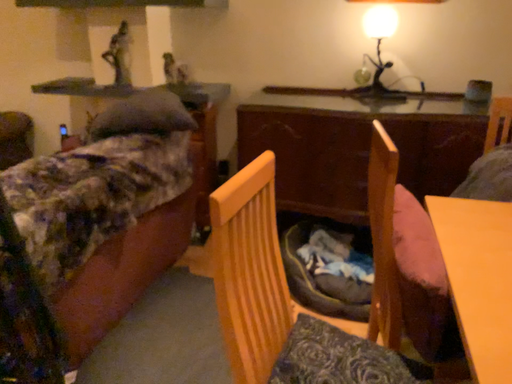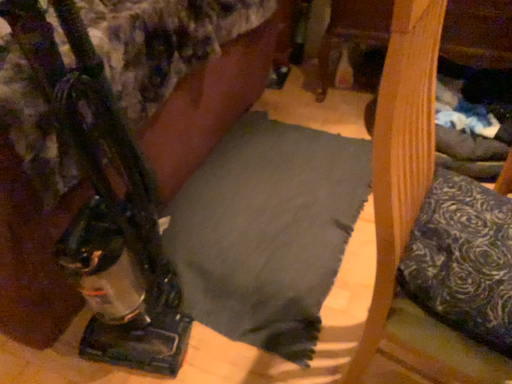
Question: How did the camera likely rotate when shooting the video?

Choices:
 (A) rotated upward
 (B) rotated downward

Answer: (B)